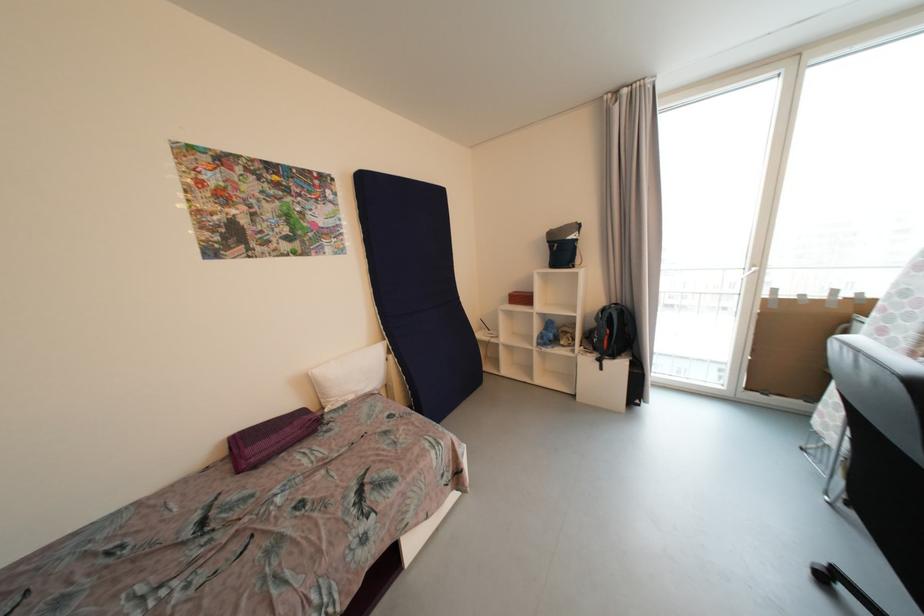
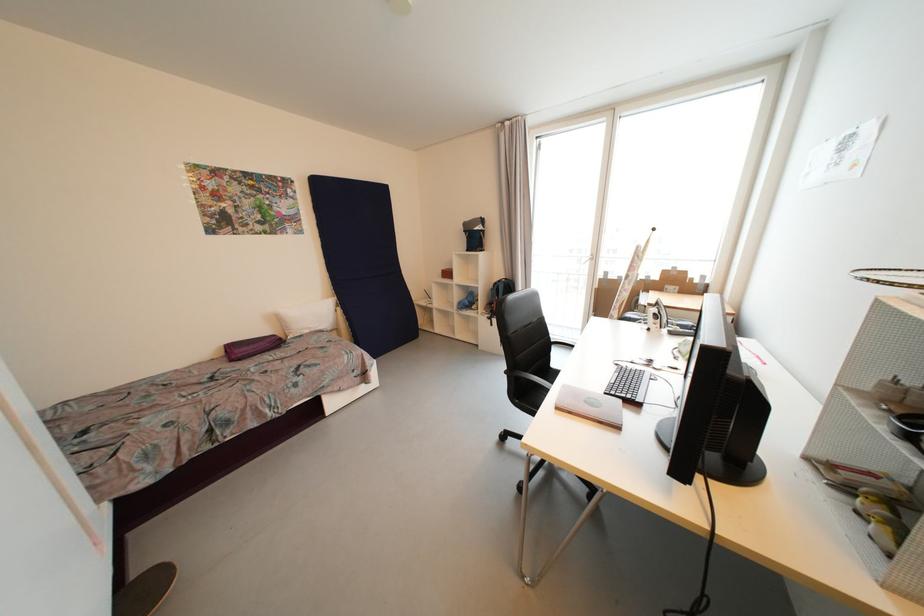
Find the pixel in the second image that matches [608,312] in the first image.

(501, 285)